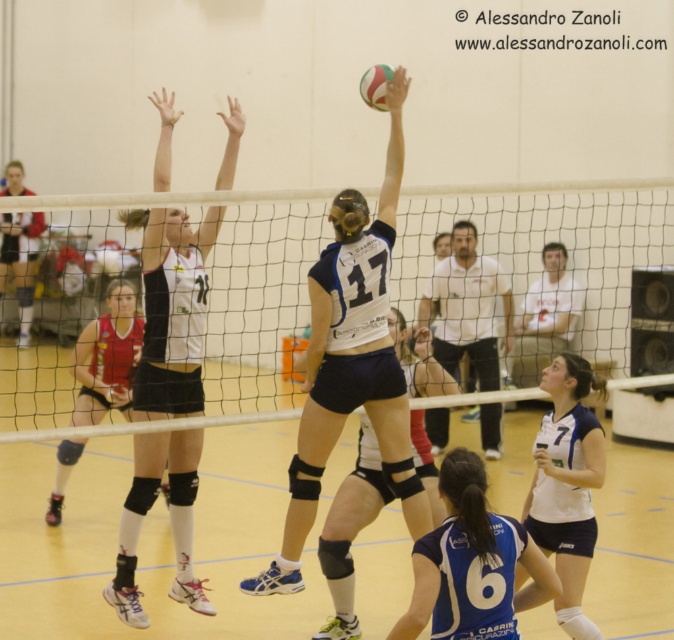
You are a volleyball player standing at the baseline of the gymnasium court. You want to hit the ball over the white mesh net at center to score a point. If your maximum reach is 2.4 meters high, will you be able to clear the net?

The white mesh net at center is 2.43 meters high. Since your maximum reach is 2.4 meters, you will not be able to clear the net as your reach is slightly lower than the net height.

You are a photographer standing at the back of the gymnasium taking pictures of the volleyball match. You notice two points marked in the image at coordinates point (384, 278) and point (24, 275). Which point is closer to your camera?

Point (384, 278) is closer to the camera than point (24, 275).